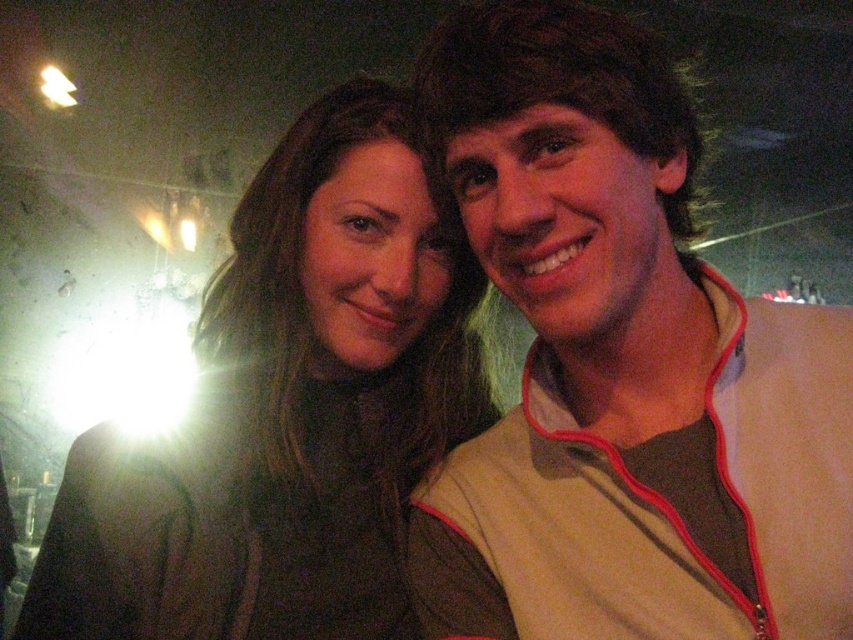
Can you confirm if tan fabric jacket at upper right is smaller than matte black jacket at center?

Correct, tan fabric jacket at upper right occupies less space than matte black jacket at center.

Does tan fabric jacket at upper right appear on the right side of matte black jacket at center?

Indeed, tan fabric jacket at upper right is positioned on the right side of matte black jacket at center.

Between point (498, 257) and point (389, 157), which one is positioned behind?

The point (389, 157) is behind.

Find the location of `tan fabric jacket at upper right`. tan fabric jacket at upper right is located at coordinates (622, 365).